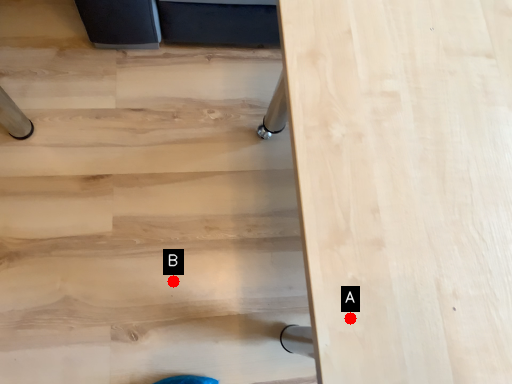
Question: Two points are circled on the image, labeled by A and B beside each circle. Which point is closer to the camera?

Choices:
 (A) A is closer
 (B) B is closer

Answer: (A)